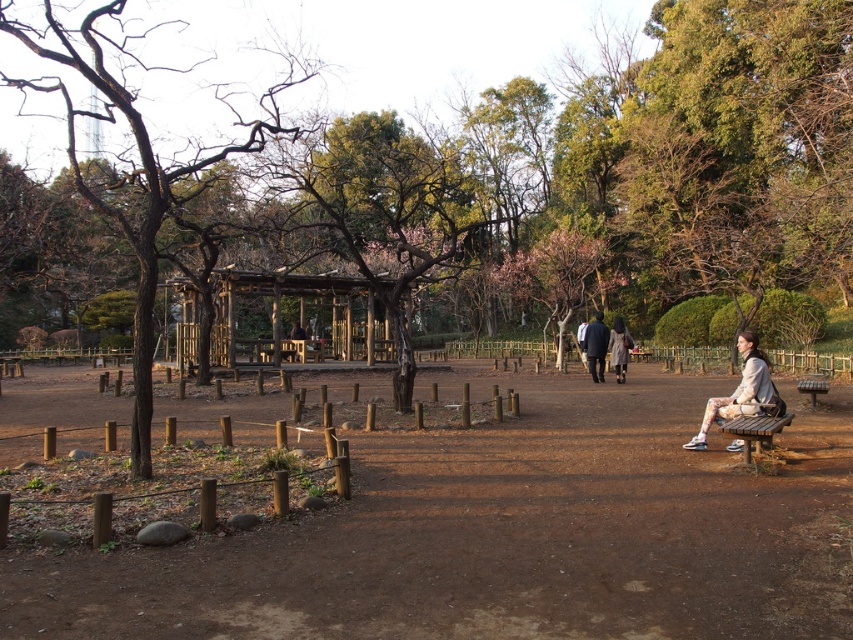
What do you see at coordinates (503, 532) in the screenshot?
I see `brown dirt path at center` at bounding box center [503, 532].

Between brown dirt path at center and dark blue coat at center, which one is positioned lower?

Positioned lower is brown dirt path at center.

Is point (769, 600) closer to camera compared to point (601, 378)?

Yes, it is in front of point (601, 378).

Where is `brown dirt path at center`? This screenshot has height=640, width=853. brown dirt path at center is located at coordinates (x=503, y=532).

Is light beige fabric jacket at lower right thinner than light gray coat at center?

No, light beige fabric jacket at lower right is not thinner than light gray coat at center.

Does light beige fabric jacket at lower right have a larger size compared to light gray coat at center?

Correct, light beige fabric jacket at lower right is larger in size than light gray coat at center.

Is point (732, 451) positioned in front of point (627, 362)?

Yes, point (732, 451) is in front of point (627, 362).

Find the location of a particular element. light beige fabric jacket at lower right is located at coordinates (740, 392).

How far apart are dark blue coat at center and light gray coat at center?

dark blue coat at center and light gray coat at center are 19.68 inches apart.

Image resolution: width=853 pixels, height=640 pixels. Describe the element at coordinates (596, 346) in the screenshot. I see `dark blue coat at center` at that location.

Describe the element at coordinates (596, 346) in the screenshot. I see `dark blue coat at center` at that location.

Locate an element on the screen. The width and height of the screenshot is (853, 640). dark blue coat at center is located at coordinates (596, 346).